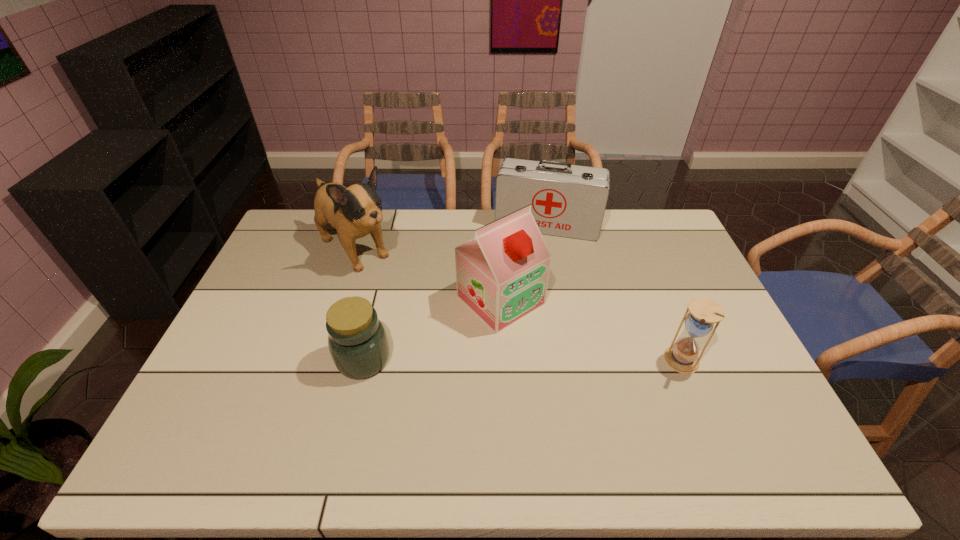
You are a GUI agent. You are given a task and a screenshot of the screen. Output one action in this format:
    pyautogui.click(x=<x>, y=<y>)
    Task: Click on the unoccupied area between the first-aid kit and the hourglass
    This screenshot has height=540, width=960.
    Given the screenshot: What is the action you would take?
    pyautogui.click(x=614, y=293)

At what (x,y) coordinates should I click in order to perform the action: click on vacant area that lies between the first-aid kit and the jar. Please return your answer as a coordinate pair (x, y). The image size is (960, 540). Looking at the image, I should click on point(455,292).

Where is `free point between the first-aid kit and the rightmost object`? free point between the first-aid kit and the rightmost object is located at coordinates (614, 293).

Point out which object is positioned as the nearest to the soya milk. Please provide its 2D coordinates. Your answer should be formatted as a tuple, i.e. [(x, y)], where the tuple contains the x and y coordinates of a point satisfying the conditions above.

[(566, 200)]

Image resolution: width=960 pixels, height=540 pixels. Identify the location of the fourth closest object to the puppy. (682, 357).

This screenshot has width=960, height=540. In order to click on vacant region that satisfies the following two spatial constraints: 1. on the front side of the first-aid kit; 2. on the left side of the rightmost object in this screenshot , I will do `click(573, 361)`.

Locate an element on the screen. The image size is (960, 540). free space in the image that satisfies the following two spatial constraints: 1. on the back side of the first-aid kit; 2. on the right side of the soya milk is located at coordinates (497, 225).

Where is `free space that satisfies the following two spatial constraints: 1. on the back side of the shortest object; 2. on the left side of the first-aid kit`? free space that satisfies the following two spatial constraints: 1. on the back side of the shortest object; 2. on the left side of the first-aid kit is located at coordinates (396, 225).

The image size is (960, 540). I want to click on free space that satisfies the following two spatial constraints: 1. on the front side of the rightmost object; 2. on the right side of the shortest object, so click(363, 361).